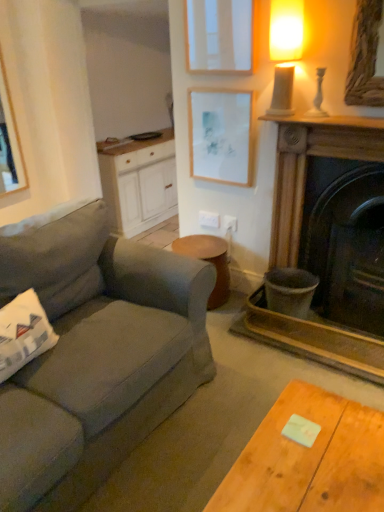
Question: Is white wood cabinet at center touching white plastic power outlet at center, marked as the first power outlet in a right-to-left arrangement?

Choices:
 (A) no
 (B) yes

Answer: (A)

Question: Is white wood cabinet at center positioned before white plastic power outlet at center, marked as the first power outlet in a right-to-left arrangement?

Choices:
 (A) yes
 (B) no

Answer: (B)

Question: Is white wood cabinet at center behind white plastic power outlet at center, the second power outlet in the left-to-right sequence?

Choices:
 (A) yes
 (B) no

Answer: (A)

Question: Does white wood cabinet at center have a smaller size compared to white plastic power outlet at center, the second power outlet in the left-to-right sequence?

Choices:
 (A) no
 (B) yes

Answer: (A)

Question: Is white wood cabinet at center looking in the opposite direction of white plastic power outlet at center, marked as the first power outlet in a right-to-left arrangement?

Choices:
 (A) no
 (B) yes

Answer: (A)

Question: From a real-world perspective, is white plastic power outlet at center, the second power outlet from the right, positioned above or below matte gray fabric couch at left?

Choices:
 (A) below
 (B) above

Answer: (B)

Question: From the image's perspective, is white plastic power outlet at center, the 1th power outlet when ordered from left to right, above or below matte gray fabric couch at left?

Choices:
 (A) below
 (B) above

Answer: (B)

Question: Relative to matte gray fabric couch at left, is white plastic power outlet at center, the 1th power outlet when ordered from left to right, in front or behind?

Choices:
 (A) front
 (B) behind

Answer: (B)

Question: Is white plastic power outlet at center, the second power outlet from the right, to the left or to the right of matte gray fabric couch at left in the image?

Choices:
 (A) right
 (B) left

Answer: (A)

Question: Is point (99, 316) positioned closer to the camera than point (195, 246)?

Choices:
 (A) farther
 (B) closer

Answer: (B)

Question: From the image's perspective, is matte gray fabric couch at left positioned above or below wooden stool at center?

Choices:
 (A) below
 (B) above

Answer: (A)

Question: Is matte gray fabric couch at left inside the boundaries of wooden stool at center, or outside?

Choices:
 (A) inside
 (B) outside

Answer: (B)

Question: From their relative heights in the image, would you say matte gray fabric couch at left is taller or shorter than wooden stool at center?

Choices:
 (A) tall
 (B) short

Answer: (A)

Question: Would you say white plastic power outlet at center, the 1th power outlet when ordered from left to right, is inside or outside white matte picture frame at upper center, the first picture frame in the top-to-bottom sequence?

Choices:
 (A) outside
 (B) inside

Answer: (A)

Question: Based on their sizes in the image, would you say white plastic power outlet at center, the second power outlet from the right, is bigger or smaller than white matte picture frame at upper center, the first picture frame in the top-to-bottom sequence?

Choices:
 (A) big
 (B) small

Answer: (B)